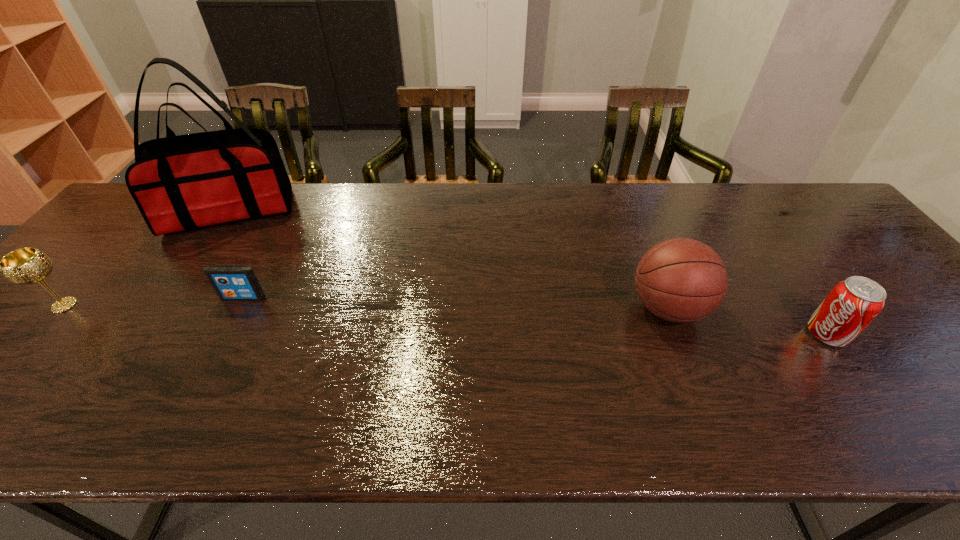
Where is `duffel bag`? duffel bag is located at coordinates (179, 183).

This screenshot has width=960, height=540. In order to click on the farthest object in this screenshot , I will do `click(179, 183)`.

The image size is (960, 540). Identify the location of the fourth object from left to right. (681, 280).

You are a GUI agent. You are given a task and a screenshot of the screen. Output one action in this format:
    pyautogui.click(x=<x>, y=<y>)
    Task: Click on the second tallest object
    Image resolution: width=960 pixels, height=540 pixels.
    Given the screenshot: What is the action you would take?
    pyautogui.click(x=681, y=280)

Find the location of a particular element. chalice is located at coordinates (24, 266).

The height and width of the screenshot is (540, 960). Identify the location of soda. (852, 304).

Identify the location of the shortest object. The height and width of the screenshot is (540, 960). (231, 282).

Locate an element on the screen. This screenshot has width=960, height=540. vacant space situated 0.190m on the right of the tallest object is located at coordinates (357, 212).

You are a GUI agent. You are given a task and a screenshot of the screen. Output one action in this format:
    pyautogui.click(x=<x>, y=<y>)
    Task: Click on the vacant space located 0.120m on the front of the second tallest object
    The width and height of the screenshot is (960, 540).
    Given the screenshot: What is the action you would take?
    click(699, 387)

Identify the location of free space located on the right of the leftmost object. This screenshot has height=540, width=960. (127, 305).